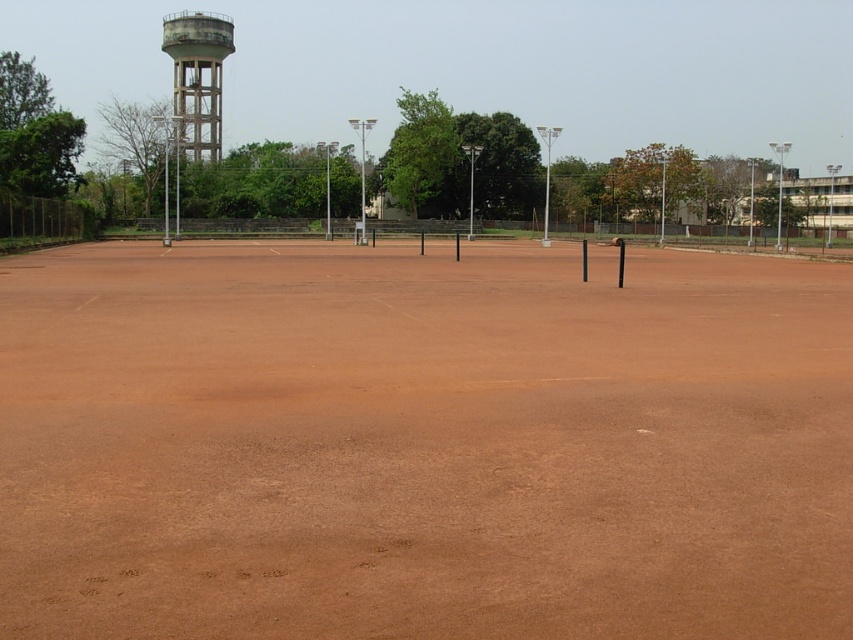
You are standing at the center of the tennis court and want to place a small bench. The bench requires a space of 1.2 meters in length. Given the brown clay court at center, can you determine if there is enough space to place the bench on the court?

The brown clay court at center is located at point (422, 444), but the exact dimensions of the court are not provided. Therefore, it is impossible to determine if there is enough space to place the bench based on the given information.

You are a drone operator trying to capture aerial footage of the brown clay court at center and the concrete water tower at upper left. Since the drone has a limited flight altitude, which object will be more challenging to fully capture in the shot?

The concrete water tower at upper left is taller than the brown clay court at center, so it will be more challenging to fully capture in the shot because its greater height requires a higher altitude to encompass the entire structure.

You are standing on the brown clay court at center and want to walk towards the concrete water tower at upper left. Which direction should you face to move directly toward it?

You should face to the left because the brown clay court at center is to the right of the concrete water tower at upper left, meaning the water tower is located to your left side.